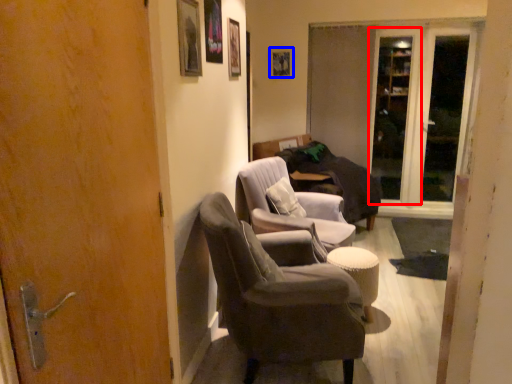
Question: Which of the following is the closest to the observer, screen door (highlighted by a red box) or picture frame (highlighted by a blue box)?

Choices:
 (A) screen door
 (B) picture frame

Answer: (A)